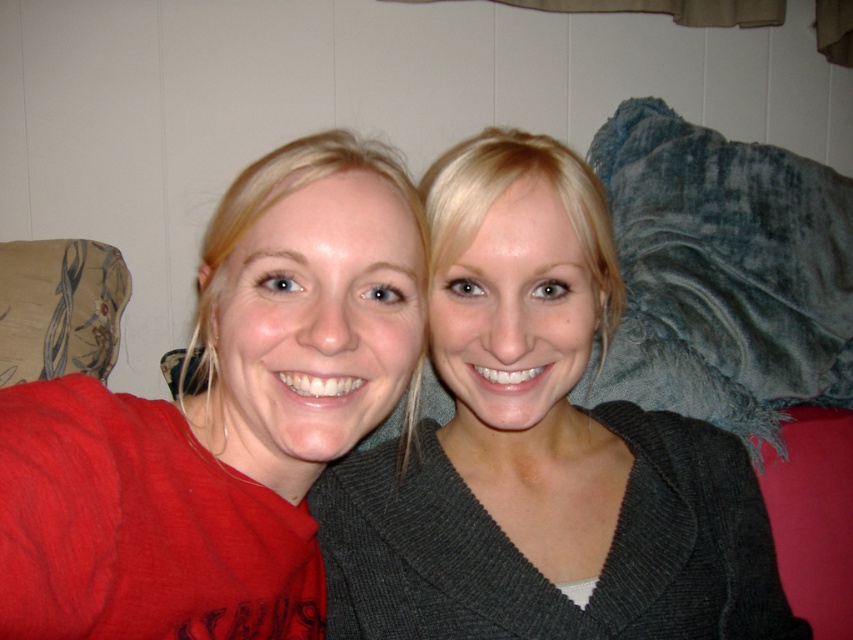
Question: Is red matte shirt at left bigger than floral fabric pillow at left?

Choices:
 (A) yes
 (B) no

Answer: (A)

Question: Does matte gray sweater at center have a smaller size compared to red matte shirt at left?

Choices:
 (A) yes
 (B) no

Answer: (B)

Question: Which point is closer to the camera taking this photo?

Choices:
 (A) (28, 259)
 (B) (126, 529)

Answer: (B)

Question: Which point appears closest to the camera in this image?

Choices:
 (A) (351, 490)
 (B) (71, 308)

Answer: (A)

Question: Which point is closer to the camera?

Choices:
 (A) (346, 461)
 (B) (62, 355)

Answer: (A)

Question: Does red matte shirt at left appear over floral fabric pillow at left?

Choices:
 (A) yes
 (B) no

Answer: (B)